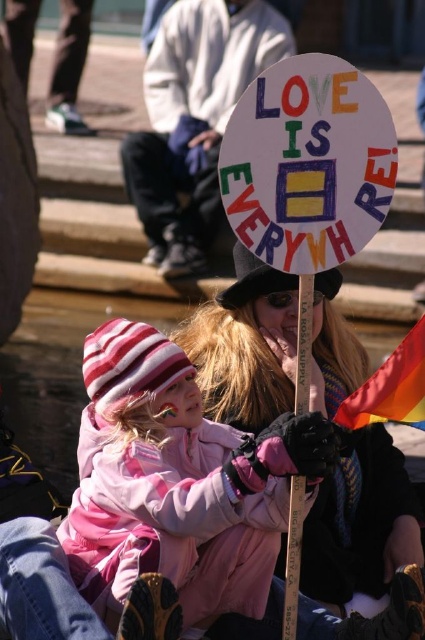
You are a photographer trying to capture both the pink fleece jacket at center and the wooden signpost at center in a single frame. Based on their sizes, which object should you focus on to ensure both fit clearly in the photo?

The pink fleece jacket at center is bigger than the wooden signpost at center, so you should focus on the pink fleece jacket at center to ensure both fit clearly in the photo.